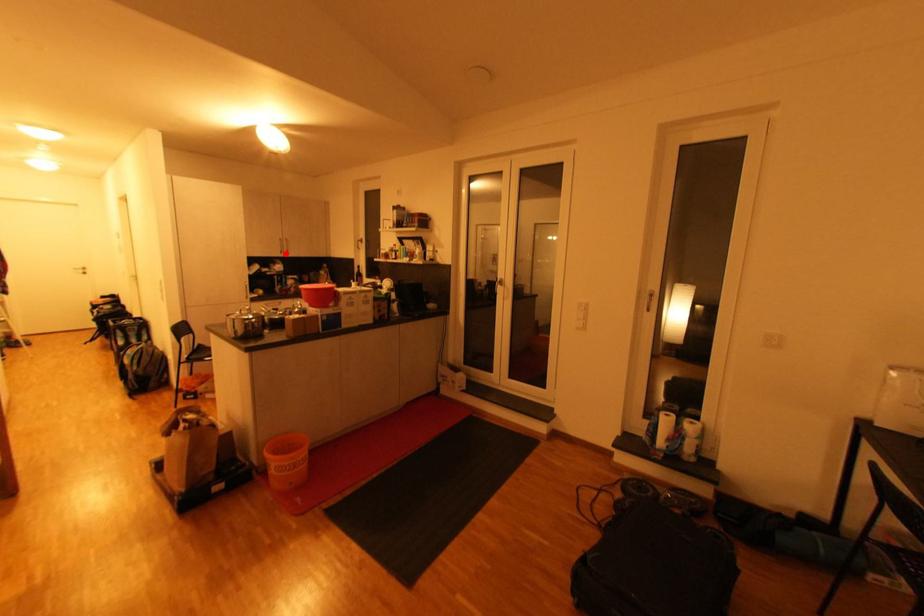
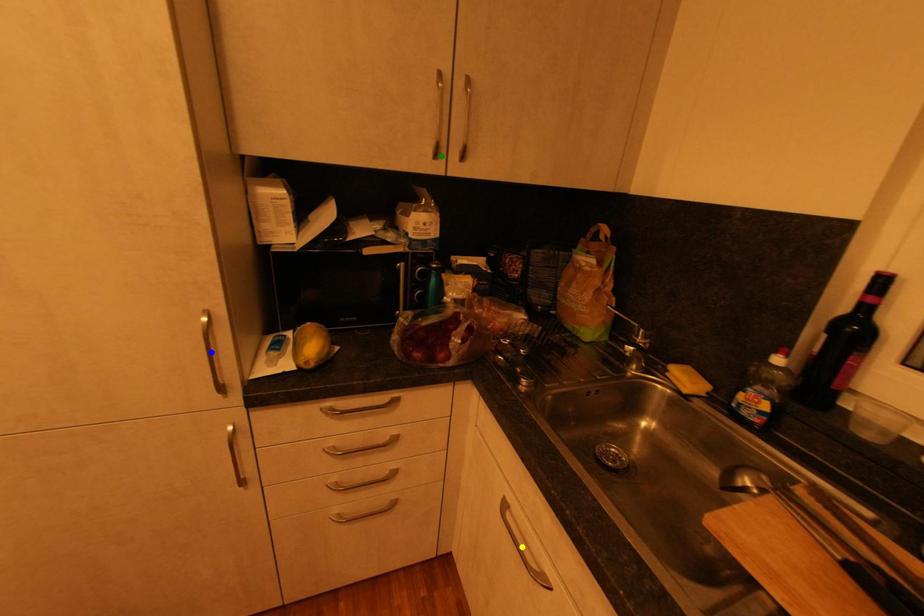
Question: I am providing you with two images of the same scene from different viewpoints. A red point is marked on the first image. You are given multiple points on the second image. Which point in image 2 represents the same 3d spot as the red point in image 1?

Choices:
 (A) green point
 (B) yellow point
 (C) blue point

Answer: (A)